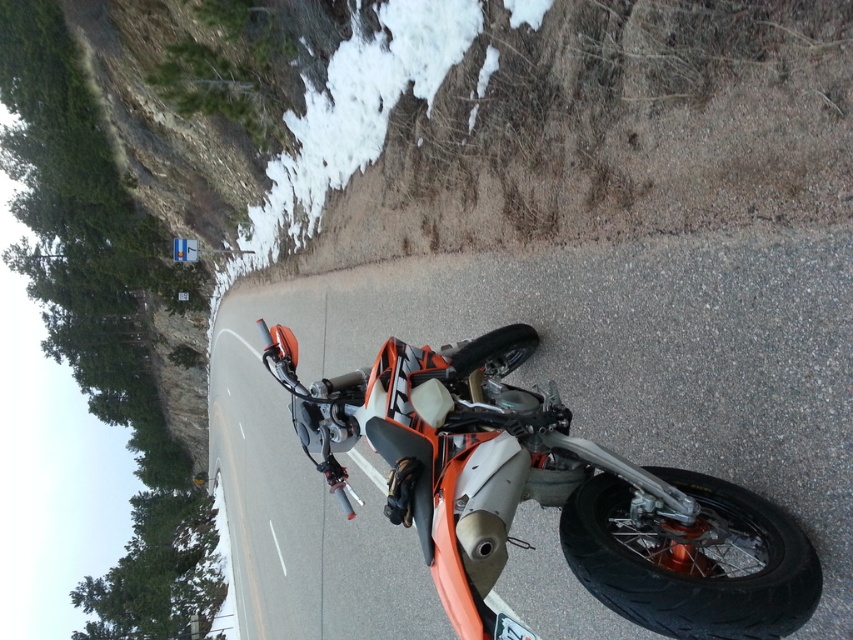
Is point (248, 228) positioned behind point (468, 352)?

That is True.

Does white powdery snow at upper center have a larger size compared to black rubber tire at lower center?

Indeed, white powdery snow at upper center has a larger size compared to black rubber tire at lower center.

Is point (299, 150) less distant than point (514, 326)?

No, it is not.

Locate an element on the screen. white powdery snow at upper center is located at coordinates (352, 116).

Who is taller, black rubber tire at lower right or white powdery snow at upper center?

white powdery snow at upper center is taller.

Is black rubber tire at lower right above white powdery snow at upper center?

Actually, black rubber tire at lower right is below white powdery snow at upper center.

Find the location of a particular element. black rubber tire at lower right is located at coordinates (691, 560).

Locate an element on the screen. black rubber tire at lower right is located at coordinates (691, 560).

Is orange matte/satin motorcycle at center to the left of black rubber tire at lower right from the viewer's perspective?

Yes, orange matte/satin motorcycle at center is to the left of black rubber tire at lower right.

Can you confirm if orange matte/satin motorcycle at center is smaller than black rubber tire at lower right?

Actually, orange matte/satin motorcycle at center might be larger than black rubber tire at lower right.

The image size is (853, 640). Find the location of `orange matte/satin motorcycle at center`. orange matte/satin motorcycle at center is located at coordinates (548, 499).